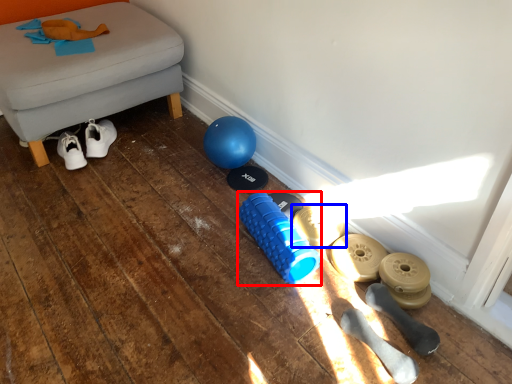
Question: Which of the following is the farthest to the observer, dumbbell (highlighted by a red box) or footwear (highlighted by a blue box)?

Choices:
 (A) dumbbell
 (B) footwear

Answer: (B)